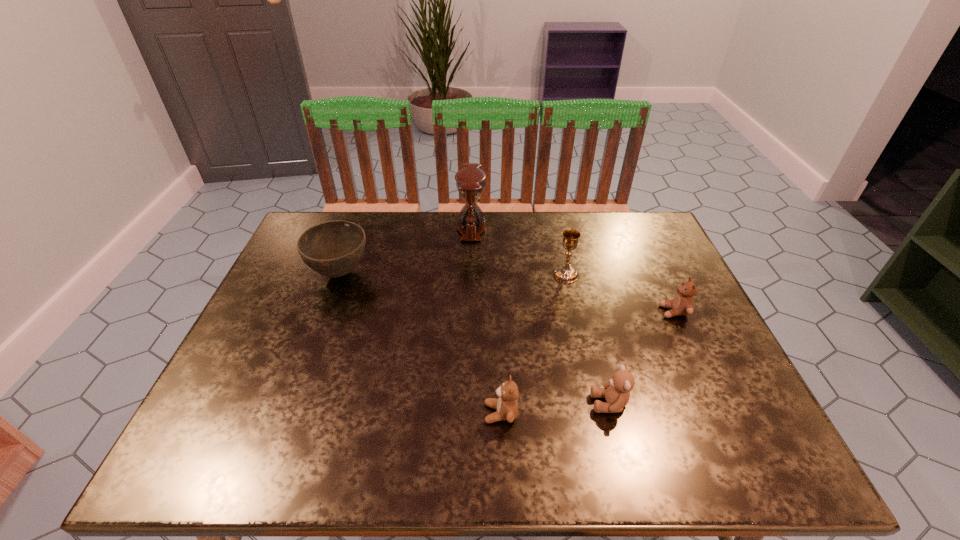
Locate an element on the screen. The width and height of the screenshot is (960, 540). the tallest object is located at coordinates (x=470, y=181).

The height and width of the screenshot is (540, 960). I want to click on the farthest object, so click(x=470, y=181).

Identify the location of chalice. (566, 273).

Locate an element on the screen. the leftmost object is located at coordinates (333, 249).

Identify the location of the rightmost object. (682, 304).

The height and width of the screenshot is (540, 960). I want to click on the farthest teddy bear, so click(x=682, y=304).

Image resolution: width=960 pixels, height=540 pixels. Identify the location of the leftmost teddy bear. (506, 405).

Where is `the second teddy bear from left to right`? The height and width of the screenshot is (540, 960). the second teddy bear from left to right is located at coordinates (616, 391).

I want to click on free location located on the right of the hourglass, so click(x=542, y=228).

Find the location of a particular element. The image size is (960, 540). free space located on the front of the chalice is located at coordinates 584,355.